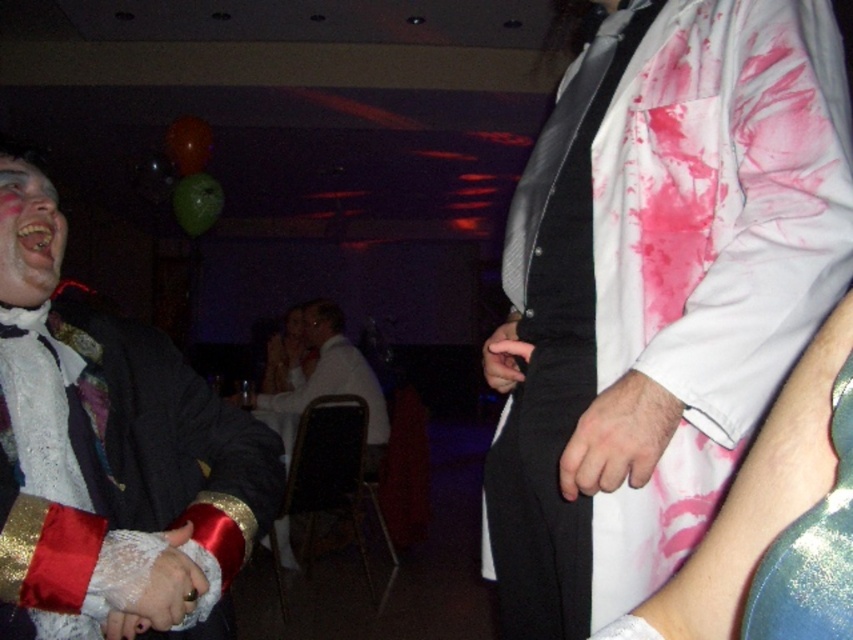
You are a photographer adjusting your camera settings to capture the best shot of the scene. You notice the smooth skin hand at center and the white satin shirt at center. Which object is positioned lower in the frame?

The smooth skin hand at center is positioned lower in the frame since it has a lesser height compared to the white satin shirt at center.

You are a photographer at the event and want to capture a photo of both the smooth skin hand at center and the white satin shirt at center. Based on their positions, which object should you focus on first to ensure both are in frame?

The smooth skin hand at center is to the right of the white satin shirt at center, so you should focus on the white satin shirt at center first to ensure both are in frame.

You are a photographer at the event and need to capture a closeup of both the white lace glove at left and the white satin shirt at center. Since you can only focus on one object at a time, which one should you focus on first to ensure the other is still in the frame?

The white lace glove at left is positioned on the right side of white satin shirt at center, so you should focus on the white satin shirt at center first. This way, the white lace glove at left will remain within the frame as it is adjacent to the shirt.